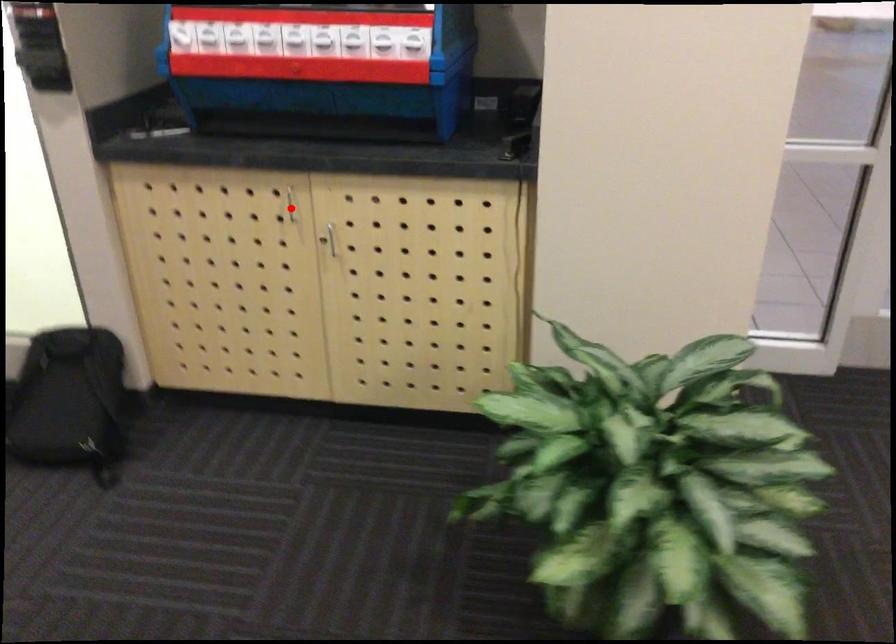
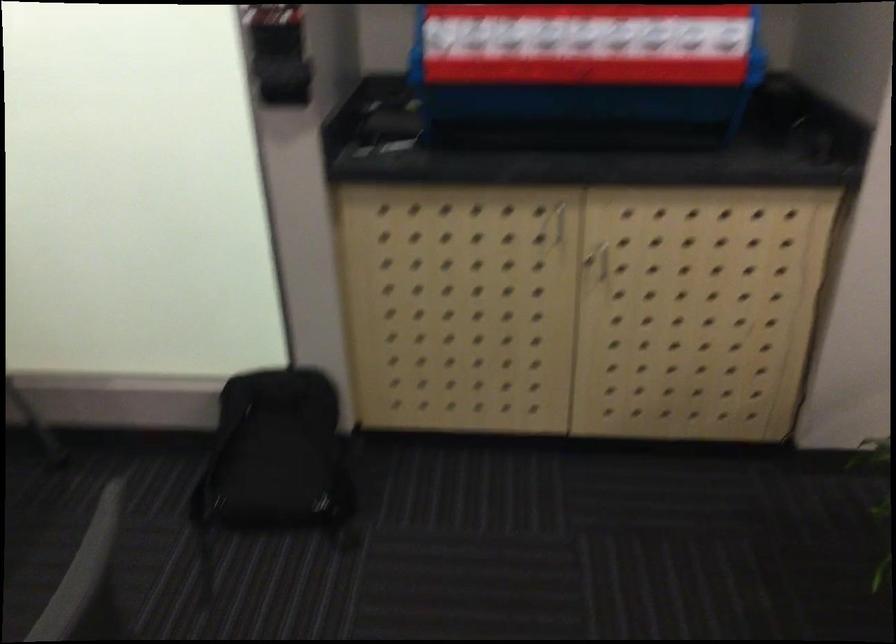
Find the pixel in the second image that matches the highlighted location in the first image.

(558, 223)